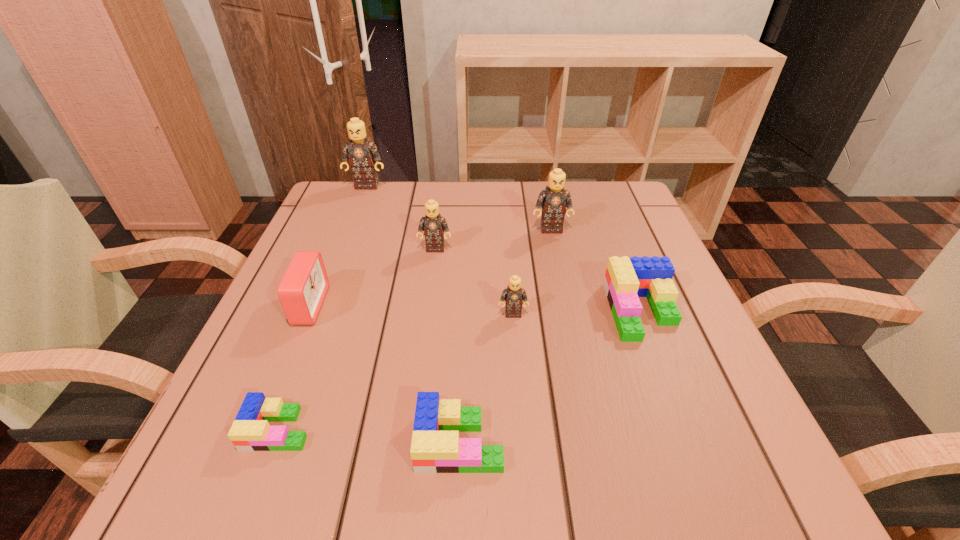
The height and width of the screenshot is (540, 960). I want to click on the biggest tan Lego, so click(x=362, y=154).

What are the coordinates of `the tallest Lego` in the screenshot? It's located at (362, 154).

In order to click on the second Lego from right to left in this screenshot , I will do `click(554, 199)`.

Locate an element on the screen. the second object from right to left is located at coordinates (554, 199).

This screenshot has width=960, height=540. Identify the location of the third tallest object. (433, 225).

Where is `the third biggest tan Lego`? This screenshot has height=540, width=960. the third biggest tan Lego is located at coordinates (433, 225).

Locate an element on the screen. This screenshot has width=960, height=540. alarm clock is located at coordinates pyautogui.click(x=302, y=290).

I want to click on the fourth shortest Lego, so click(513, 295).

What are the coordinates of `the second tan Lego from right to left` in the screenshot? It's located at point(513,295).

In order to click on the rightmost object in this screenshot , I will do `click(626, 279)`.